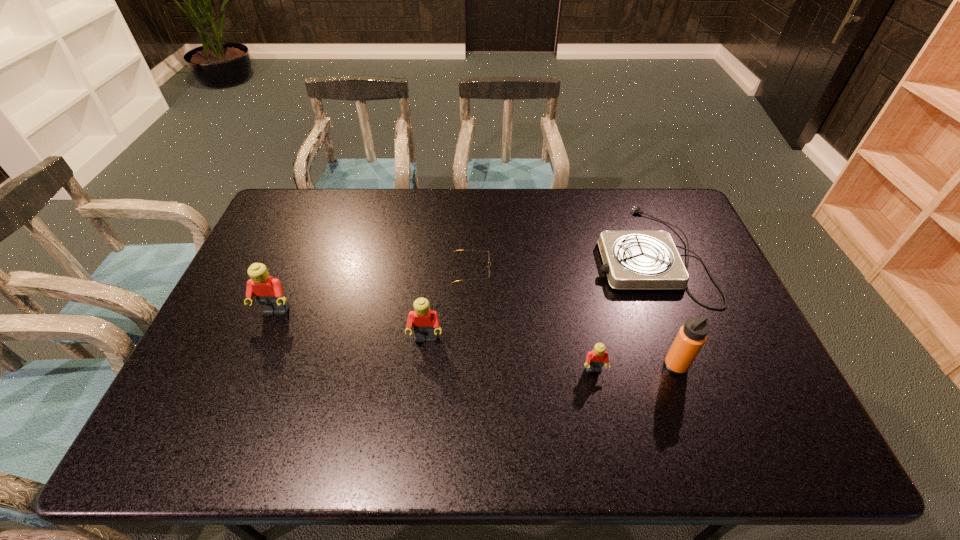
The width and height of the screenshot is (960, 540). Find the location of `vacant space located on the face of the fourth farthest object`. vacant space located on the face of the fourth farthest object is located at coordinates (420, 388).

Find the location of a particular element. This screenshot has width=960, height=540. free point located on the temples of the fourth object from right to left is located at coordinates (542, 271).

This screenshot has width=960, height=540. Find the location of `free space located 0.350m with a retractable cable on the side of the hotplate`. free space located 0.350m with a retractable cable on the side of the hotplate is located at coordinates (485, 255).

Find the location of a particular element. The height and width of the screenshot is (540, 960). blank area located with a retractable cable on the side of the hotplate is located at coordinates (578, 255).

I want to click on blank area located 0.220m with a retractable cable on the side of the hotplate, so click(525, 255).

The width and height of the screenshot is (960, 540). What are the coordinates of `free space located 0.380m on the back of the thermos bottle` in the screenshot? It's located at (636, 256).

I want to click on object that is at the far edge, so click(632, 260).

The width and height of the screenshot is (960, 540). Find the location of `object that is at the left edge`. object that is at the left edge is located at coordinates (269, 294).

In order to click on object situated at the right edge in this screenshot , I will do `click(632, 260)`.

Where is `object that is at the far right corner`? object that is at the far right corner is located at coordinates (632, 260).